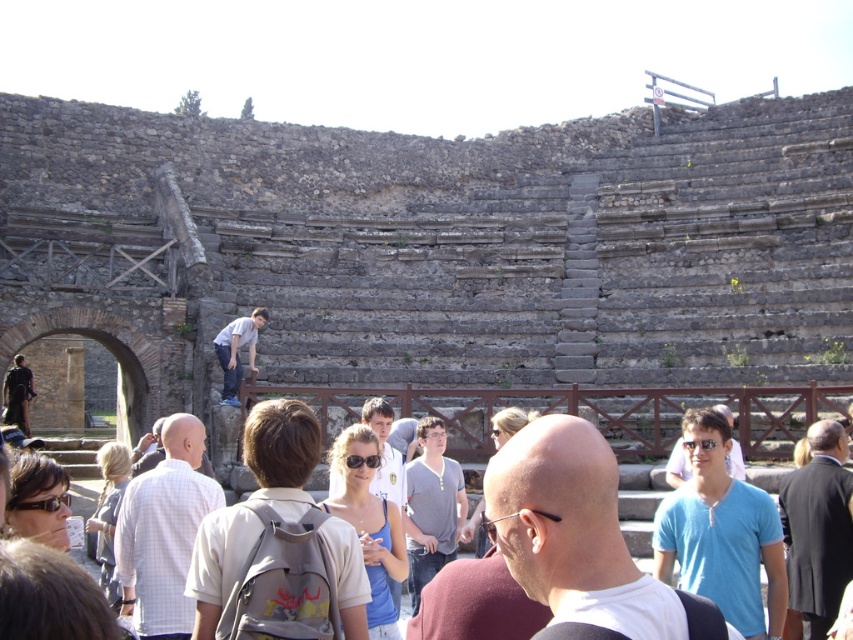
Between blue cotton shirt at center and matte gray hoodie at center, which one is positioned lower?

matte gray hoodie at center

Between blue cotton shirt at center and matte gray hoodie at center, which one appears on the right side from the viewer's perspective?

From the viewer's perspective, blue cotton shirt at center appears more on the right side.

Describe the element at coordinates (721, 532) in the screenshot. The width and height of the screenshot is (853, 640). I see `blue cotton shirt at center` at that location.

Find the location of a particular element. Image resolution: width=853 pixels, height=640 pixels. blue cotton shirt at center is located at coordinates (721, 532).

Is matte blue tank top at center in front of light brown hair at lower left?

Yes, matte blue tank top at center is in front of light brown hair at lower left.

Is matte blue tank top at center to the right of light brown hair at lower left from the viewer's perspective?

Yes, matte blue tank top at center is to the right of light brown hair at lower left.

Which is in front, point (328, 508) or point (100, 547)?

Point (328, 508) is more forward.

Identify the location of matte blue tank top at center. (369, 524).

From the picture: Is gray backpack at center positioned behind matte black sunglasses at lower left?

No, gray backpack at center is closer to the viewer.

Between point (289, 468) and point (20, 506), which one is positioned behind?

The point (289, 468) is more distant.

Between point (271, 477) and point (51, 461), which one is positioned behind?

The point (51, 461) is behind.

At what (x,y) coordinates should I click in order to perform the action: click on gray backpack at center. Please return your answer as a coordinate pair (x, y). This screenshot has height=640, width=853. Looking at the image, I should click on (281, 442).